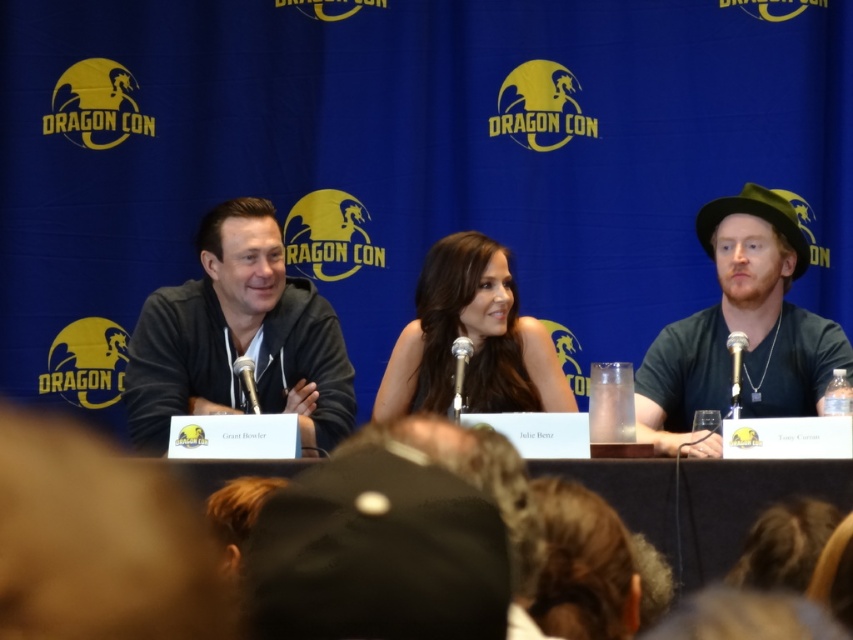
Who is positioned more to the left, dark gray hoodie at left or satin black dress at center?

Positioned to the left is dark gray hoodie at left.

Between dark gray hoodie at left and satin black dress at center, which one has less height?

satin black dress at center is shorter.

Between point (167, 356) and point (465, 243), which one is positioned in front?

Point (167, 356)

You are a GUI agent. You are given a task and a screenshot of the screen. Output one action in this format:
    pyautogui.click(x=<x>, y=<y>)
    Task: Click on the dark gray hoodie at left
    
    Given the screenshot: What is the action you would take?
    pyautogui.click(x=239, y=337)

Is matte black hat at right taller than satin black dress at center?

Yes.

Does matte black hat at right have a greater width compared to satin black dress at center?

Correct, the width of matte black hat at right exceeds that of satin black dress at center.

The height and width of the screenshot is (640, 853). I want to click on matte black hat at right, so click(740, 330).

Image resolution: width=853 pixels, height=640 pixels. In order to click on dark gray hoodie at left in this screenshot , I will do `click(239, 337)`.

Is dark gray hoodie at left bigger than matte black hat at right?

No, dark gray hoodie at left is not bigger than matte black hat at right.

What do you see at coordinates (239, 337) in the screenshot?
I see `dark gray hoodie at left` at bounding box center [239, 337].

Find the location of a particular element. The image size is (853, 640). dark gray hoodie at left is located at coordinates (239, 337).